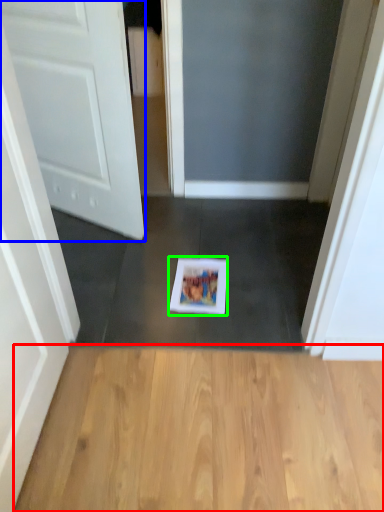
Question: Considering the real-world distances, which object is closest to hardwood (highlighted by a red box)? door (highlighted by a blue box) or copy (highlighted by a green box).

Choices:
 (A) door
 (B) copy

Answer: (B)